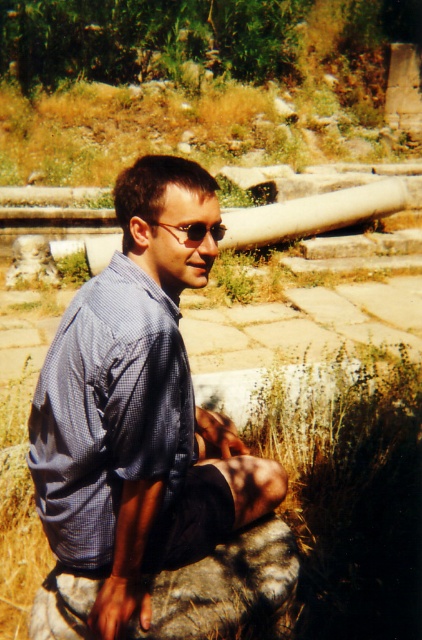
Which is in front, point (53, 342) or point (194, 225)?

Point (194, 225) is more forward.

Can you confirm if blue checkered shirt at center is taller than matte black sunglasses at center?

Correct, blue checkered shirt at center is much taller as matte black sunglasses at center.

Is point (178, 253) positioned behind point (186, 232)?

Yes, point (178, 253) is behind point (186, 232).

At what (x,y) coordinates should I click in order to perform the action: click on blue checkered shirt at center. Please return your answer as a coordinate pair (x, y). The height and width of the screenshot is (640, 422). Looking at the image, I should click on (140, 410).

Is blue checkered shirt at center shorter than blue checkered dress shirt at center?

No, blue checkered shirt at center is not shorter than blue checkered dress shirt at center.

Is point (175, 378) positioned before point (102, 396)?

No, (175, 378) is behind (102, 396).

The width and height of the screenshot is (422, 640). What do you see at coordinates (140, 410) in the screenshot?
I see `blue checkered shirt at center` at bounding box center [140, 410].

The width and height of the screenshot is (422, 640). Identify the location of blue checkered shirt at center. (140, 410).

In the scene shown: Who is shorter, blue checkered dress shirt at center or matte black sunglasses at center?

Standing shorter between the two is matte black sunglasses at center.

Describe the element at coordinates (108, 410) in the screenshot. This screenshot has height=640, width=422. I see `blue checkered dress shirt at center` at that location.

Between point (88, 392) and point (221, 234), which one is positioned in front?

Point (88, 392) is more forward.

I want to click on blue checkered dress shirt at center, so tap(108, 410).